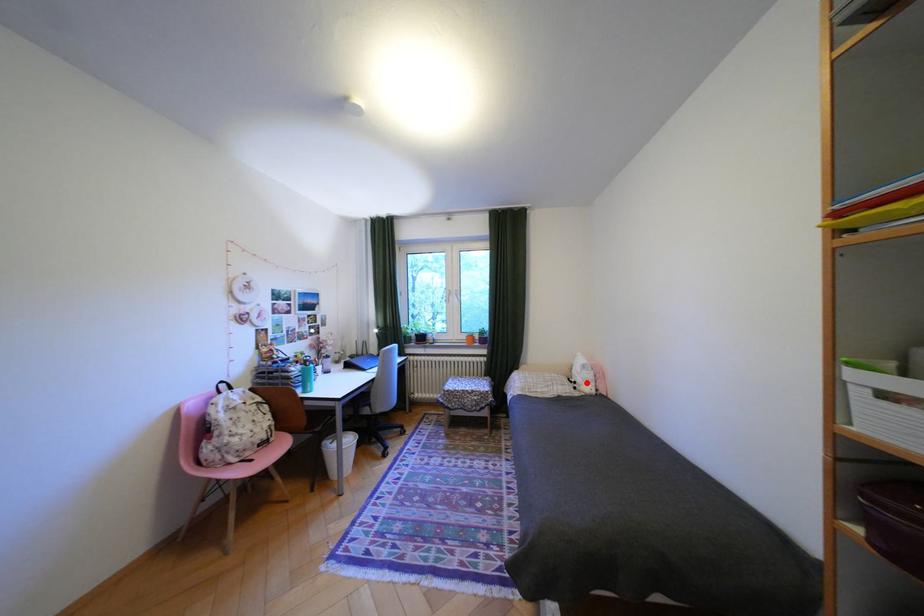
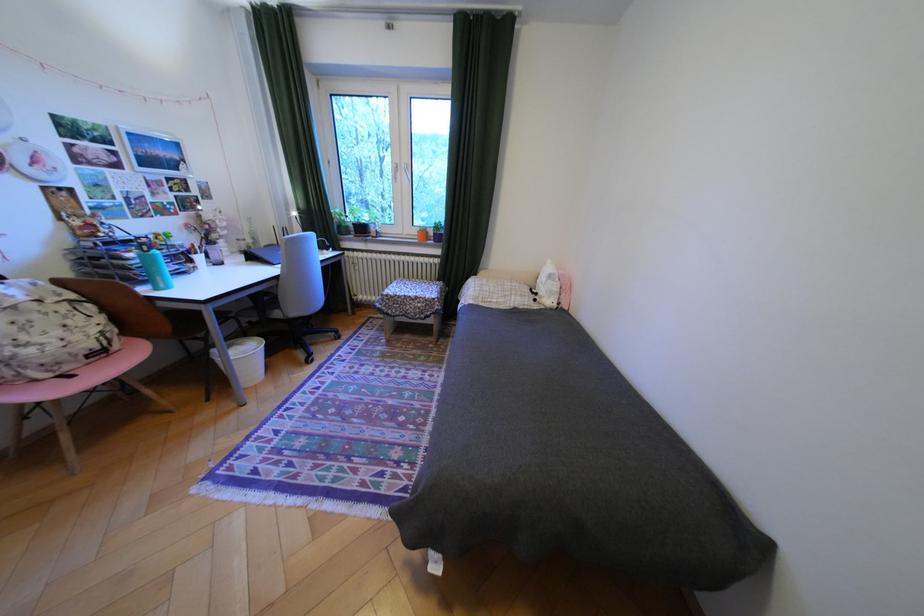
Find the pixel in the second image that matches the highlighted location in the first image.

(548, 294)